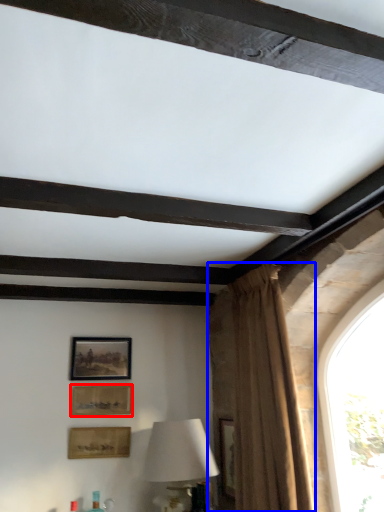
Question: Among these objects, which one is nearest to the camera, picture frame (highlighted by a red box) or curtain (highlighted by a blue box)?

Choices:
 (A) picture frame
 (B) curtain

Answer: (B)